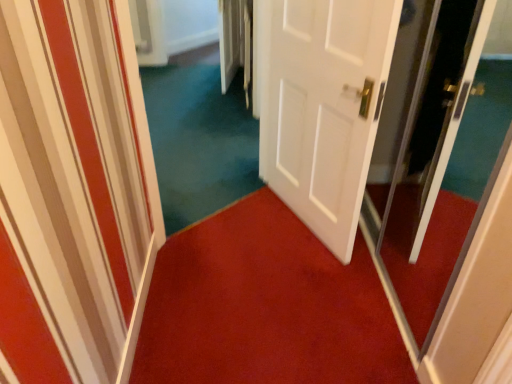
Question: Is white matte door at center not within red carpet at center?

Choices:
 (A) yes
 (B) no

Answer: (A)

Question: From a real-world perspective, is white matte door at center positioned under red carpet at center based on gravity?

Choices:
 (A) no
 (B) yes

Answer: (A)

Question: Is white matte door at center wider than red carpet at center?

Choices:
 (A) yes
 (B) no

Answer: (B)

Question: Does white matte door at center lie behind red carpet at center?

Choices:
 (A) yes
 (B) no

Answer: (B)

Question: From the image's perspective, is white matte door at center over red carpet at center?

Choices:
 (A) yes
 (B) no

Answer: (A)

Question: Considering the relative sizes of white matte door at center and red carpet at center in the image provided, is white matte door at center taller than red carpet at center?

Choices:
 (A) no
 (B) yes

Answer: (B)

Question: Could transparent glass screen door at right be considered to be inside white matte door at center?

Choices:
 (A) yes
 (B) no

Answer: (B)

Question: Does white matte door at center have a lesser height compared to transparent glass screen door at right?

Choices:
 (A) no
 (B) yes

Answer: (B)

Question: Is white matte door at center wider than transparent glass screen door at right?

Choices:
 (A) no
 (B) yes

Answer: (B)

Question: Can you confirm if white matte door at center is thinner than transparent glass screen door at right?

Choices:
 (A) no
 (B) yes

Answer: (A)

Question: Could you tell me if white matte door at center is facing transparent glass screen door at right?

Choices:
 (A) yes
 (B) no

Answer: (B)

Question: From the image's perspective, is white matte door at center on transparent glass screen door at right?

Choices:
 (A) no
 (B) yes

Answer: (B)

Question: Does white matte door at center have a greater width compared to teal carpet at center?

Choices:
 (A) no
 (B) yes

Answer: (A)